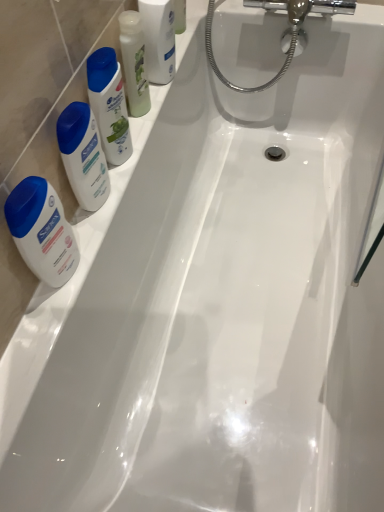
Question: Would you say matte white shampoo at left, arranged as the 2th cleaning product when viewed from the top, is inside or outside clear plastic mouthwash at upper left, which ranks as the 2th mouthwash in left-to-right order?

Choices:
 (A) inside
 (B) outside

Answer: (B)

Question: From a real-world perspective, is matte white shampoo at left, the 1th cleaning product when ordered from bottom to top, physically located above or below clear plastic mouthwash at upper left, which ranks as the 2th mouthwash in left-to-right order?

Choices:
 (A) below
 (B) above

Answer: (A)

Question: Which object is the farthest from the matte white shampoo at left, arranged as the 2th cleaning product when viewed from the top?

Choices:
 (A) white glossy shampoo bottle at upper left, the second cleaning product ordered from the bottom
 (B) translucent plastic mouthwash at upper left, marked as the second mouthwash in a right-to-left arrangement
 (C) clear plastic mouthwash at upper left, which ranks as the 2th mouthwash in left-to-right order
 (D) matte white lotion at left

Answer: (C)

Question: Estimate the real-world distances between objects in this image. Which object is farther from the matte white lotion at left?

Choices:
 (A) translucent plastic mouthwash at upper left, marked as the second mouthwash in a right-to-left arrangement
 (B) white glossy shampoo bottle at upper left, acting as the 1th cleaning product starting from the top
 (C) matte white shampoo at left, arranged as the 2th cleaning product when viewed from the top
 (D) clear plastic mouthwash at upper left, which is the 1th mouthwash from right to left

Answer: (D)